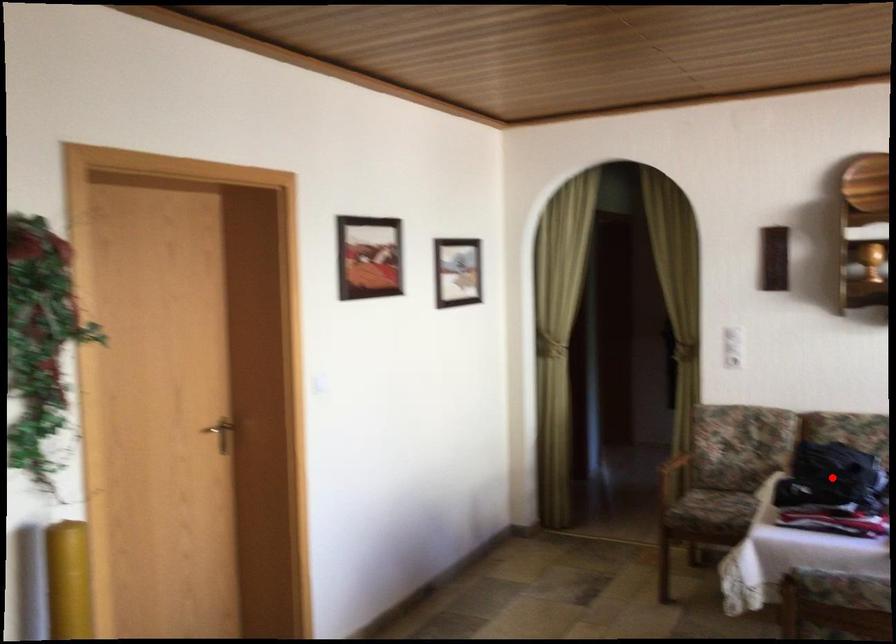
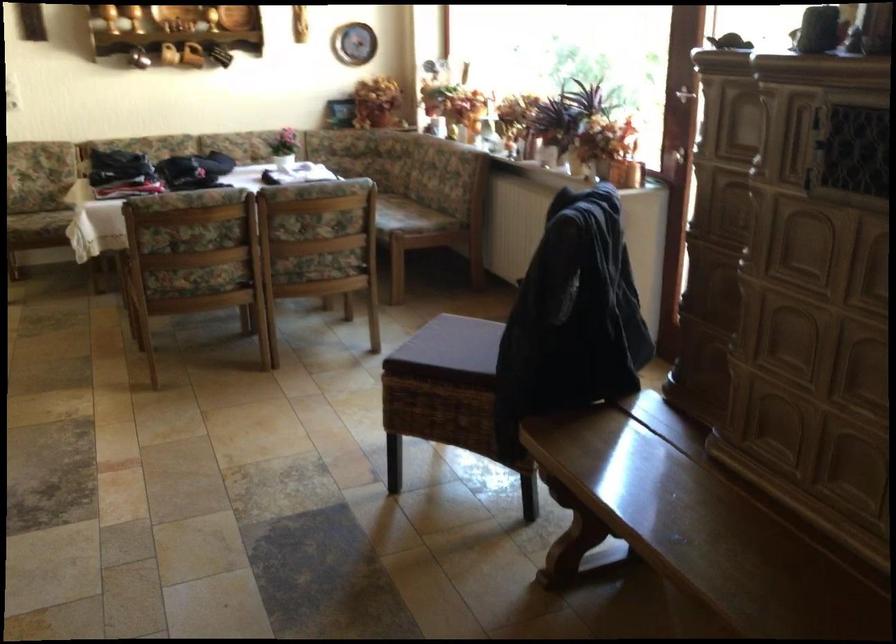
Question: I am providing you with two images of the same scene from different viewpoints. A red point is marked on the first image. Is the red point's position out of view in image 2?

Choices:
 (A) Yes
 (B) No

Answer: (A)